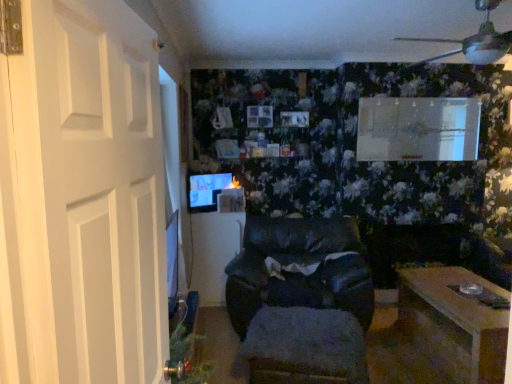
Locate an element on the screen. vacant space situated above fuzzy fabric footrest at center (from a real-world perspective) is located at coordinates (302, 319).